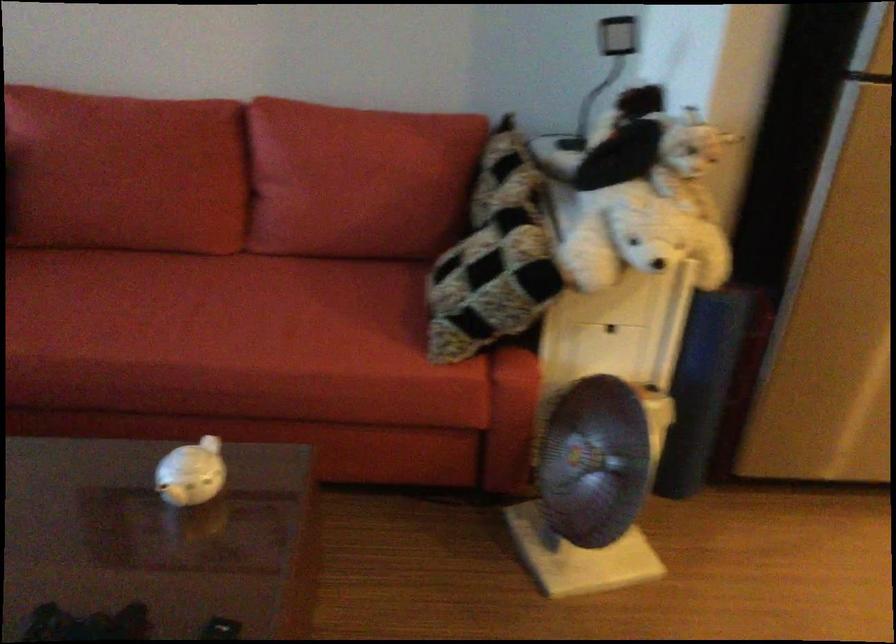
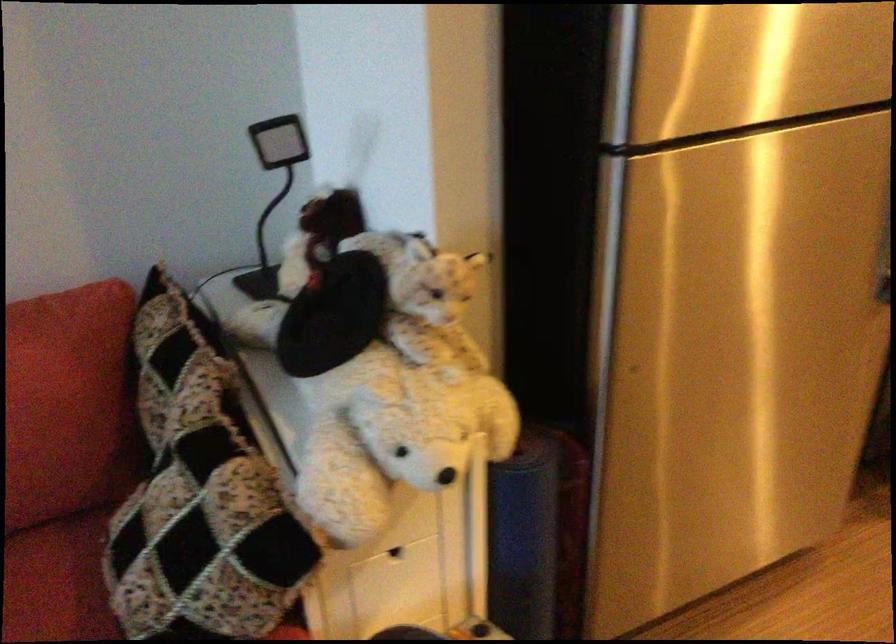
Question: The camera is either moving clockwise (left) or counter-clockwise (right) around the object. The first image is from the beginning of the video and the second image is from the end. Is the camera moving left or right when shooting the video?

Choices:
 (A) Left
 (B) Right

Answer: (A)